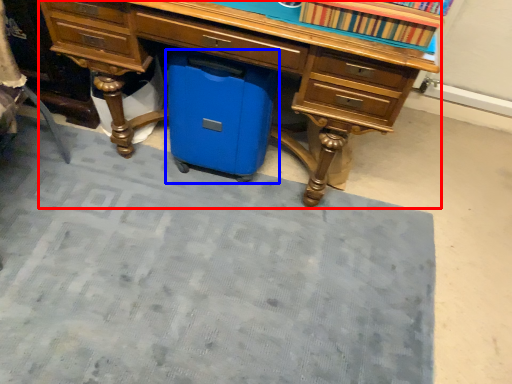
Question: Which of the following is the closest to the observer, desk (highlighted by a red box) or cooler (highlighted by a blue box)?

Choices:
 (A) desk
 (B) cooler

Answer: (A)